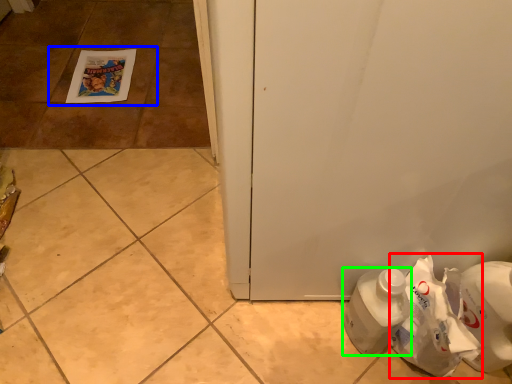
Question: Which is nearer to the paper bag (highlighted by a red box)? tile (highlighted by a blue box) or bottle (highlighted by a green box).

Choices:
 (A) tile
 (B) bottle

Answer: (B)